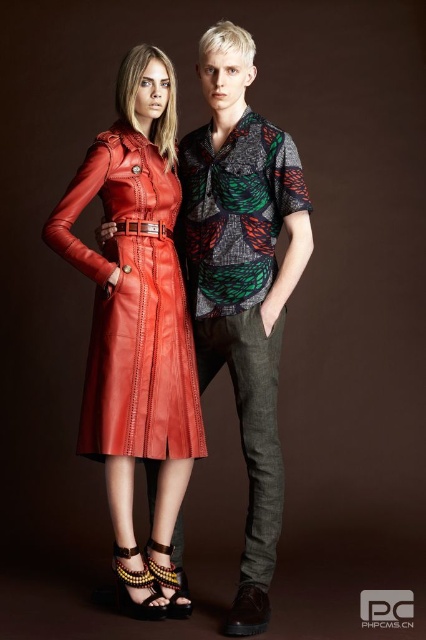
Is matte leather dress at left positioned before gold metallic sandal at lower center?

Yes, matte leather dress at left is closer to the viewer.

Is point (108, 188) closer to camera compared to point (157, 544)?

Yes.

Where is `matte leather dress at left`? matte leather dress at left is located at coordinates [132, 305].

I want to click on matte leather dress at left, so click(x=132, y=305).

Can you confirm if multicolored beaded sandal at lower center is positioned to the left of gold metallic sandal at lower center?

Correct, you'll find multicolored beaded sandal at lower center to the left of gold metallic sandal at lower center.

Which is in front, point (149, 600) or point (170, 570)?

Positioned in front is point (149, 600).

Locate an element on the screen. multicolored beaded sandal at lower center is located at coordinates (135, 586).

Locate an element on the screen. matte leather dress at center is located at coordinates [x=135, y=300].

Can you confirm if matte leather dress at center is taller than matte leather dress at left?

Correct, matte leather dress at center is much taller as matte leather dress at left.

Is point (97, 328) closer to viewer compared to point (149, 348)?

No, it is behind (149, 348).

You are a GUI agent. You are given a task and a screenshot of the screen. Output one action in this format:
    pyautogui.click(x=<x>, y=<y>)
    Task: Click on the matte leather dress at center
    Image resolution: width=426 pixels, height=640 pixels.
    Given the screenshot: What is the action you would take?
    pyautogui.click(x=135, y=300)